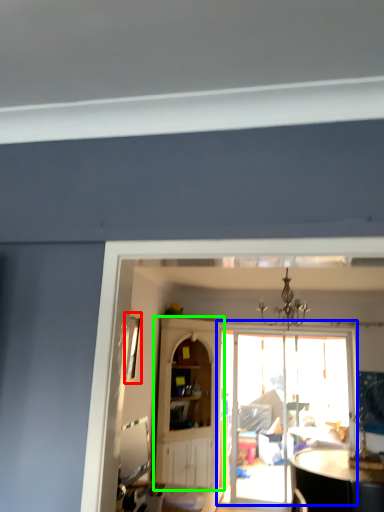
Question: Which object is positioned farthest from window (highlighted by a red box)? Select from door (highlighted by a blue box) and cabinetry (highlighted by a green box).

Choices:
 (A) door
 (B) cabinetry

Answer: (A)